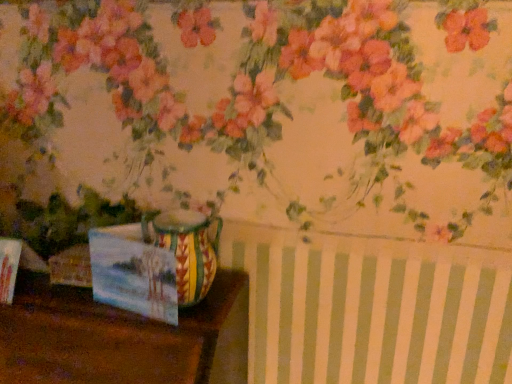
Find the location of `blank area to the left of matte paper postcard at lower left`. blank area to the left of matte paper postcard at lower left is located at coordinates (62, 306).